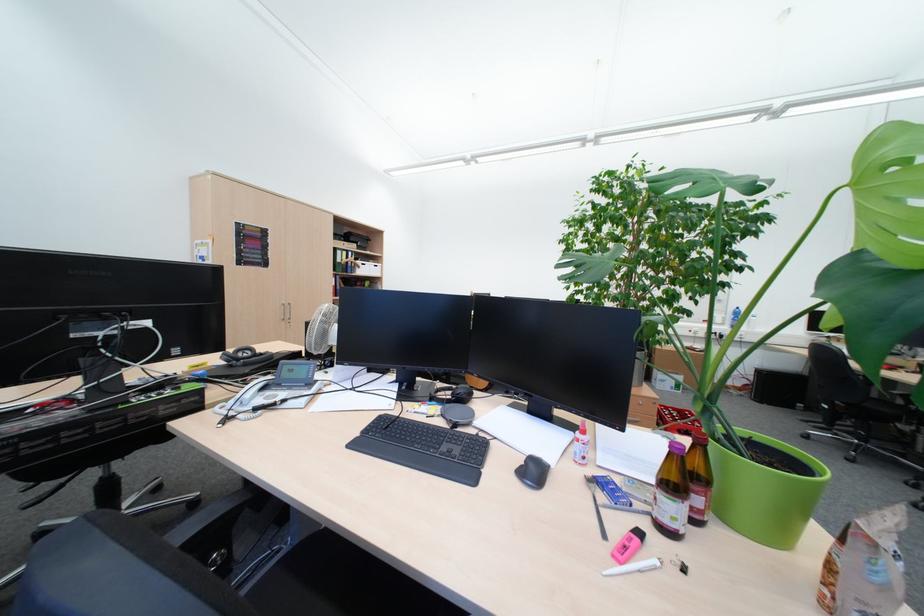
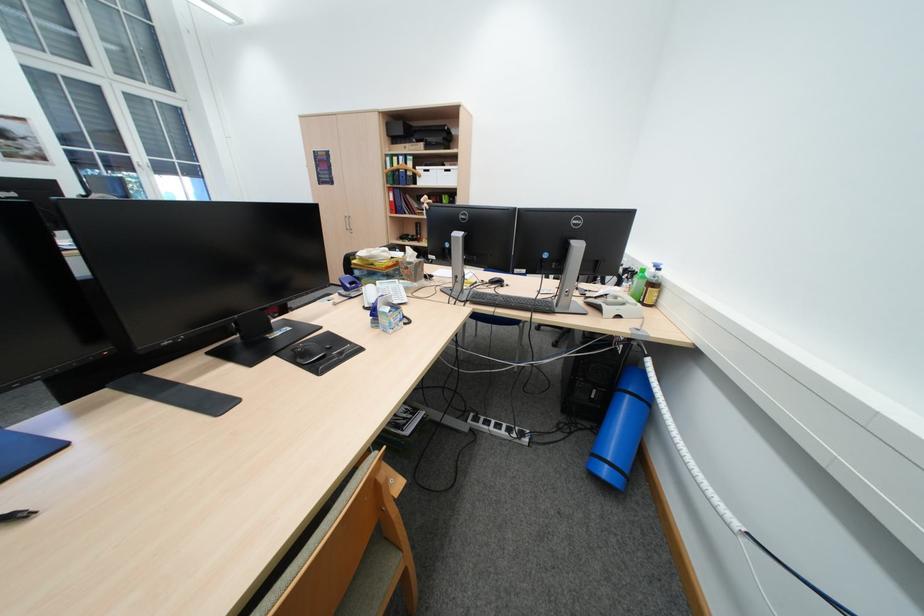
Locate, in the second image, the point that corresponds to the point at 359,252 in the first image.

(409, 156)